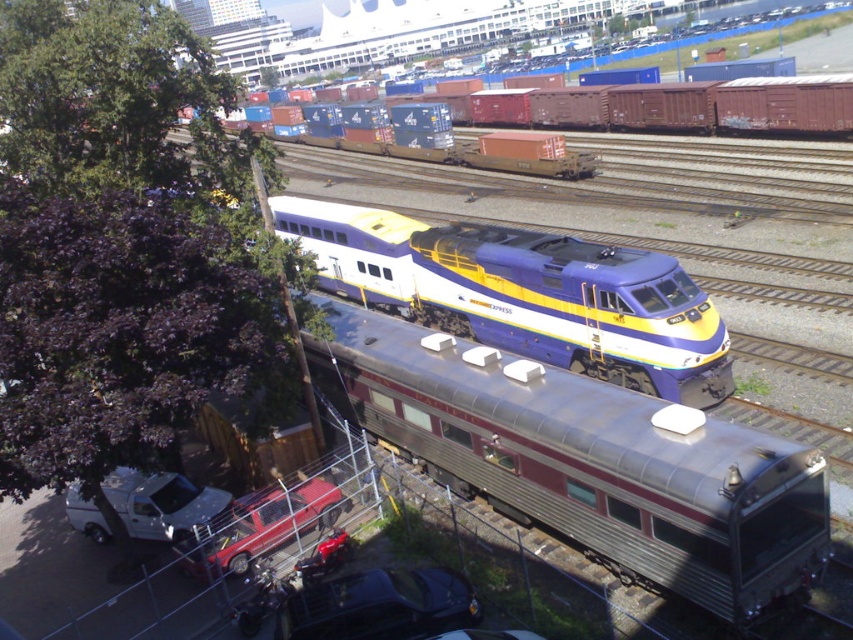
You are standing at the center of the train yard and want to locate the metallic red pickup truck at lower left. According to the coordinates provided, where should you look relative to your current position?

The metallic red pickup truck at lower left is located at coordinates point (260, 525). Since you are at the center, you should look towards the lower left direction to find it.

You are a worker at the train yard who needs to move the metallic red pickup truck at lower left to the other side of the metallic freight car at upper center. Based on their current positions, can you drive the pickup truck directly forward to pass in front of the freight car?

The metallic red pickup truck at lower left is behind the metallic freight car at upper center, so you can drive the pickup truck directly forward to pass in front of the freight car.